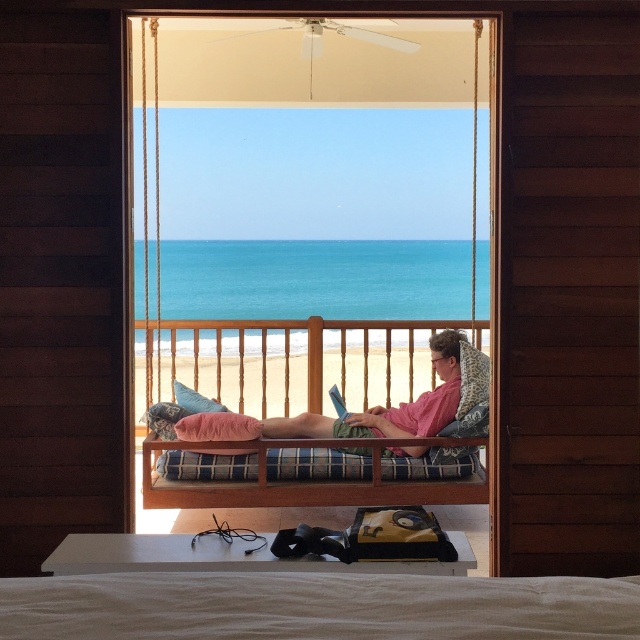
Does wooden cushioned swing at center come behind teal fabric pillow at center?

No, wooden cushioned swing at center is closer to the viewer.

Measure the distance between point (x=456, y=115) and camera.

Point (x=456, y=115) and camera are 16.98 meters apart from each other.

The height and width of the screenshot is (640, 640). What do you see at coordinates (308, 172) in the screenshot? I see `wooden cushioned swing at center` at bounding box center [308, 172].

Locate an element on the screen. wooden cushioned swing at center is located at coordinates (308, 172).

Between plaid fabric bed at center and teal fabric pillow at center, which one appears on the right side from the viewer's perspective?

Positioned to the right is plaid fabric bed at center.

Does plaid fabric bed at center appear on the right side of teal fabric pillow at center?

Indeed, plaid fabric bed at center is positioned on the right side of teal fabric pillow at center.

Is point (246, 492) closer to viewer compared to point (193, 406)?

Yes.

The width and height of the screenshot is (640, 640). In order to click on plaid fabric bed at center in this screenshot , I will do `click(326, 445)`.

Is wooden cushioned swing at center to the left of plaid fabric bed at center from the viewer's perspective?

Indeed, wooden cushioned swing at center is positioned on the left side of plaid fabric bed at center.

Image resolution: width=640 pixels, height=640 pixels. I want to click on wooden cushioned swing at center, so click(308, 172).

This screenshot has height=640, width=640. I want to click on wooden cushioned swing at center, so click(308, 172).